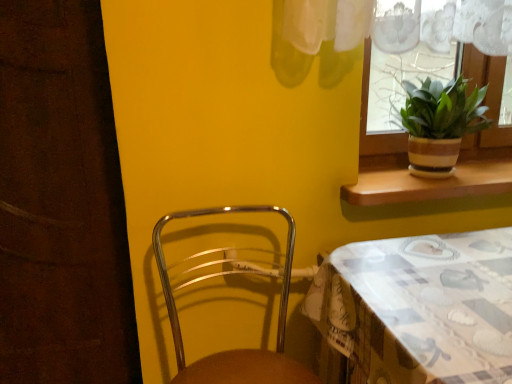
Identify the location of vacant space underneath green striped pot at window (from a real-world perspective). (438, 178).